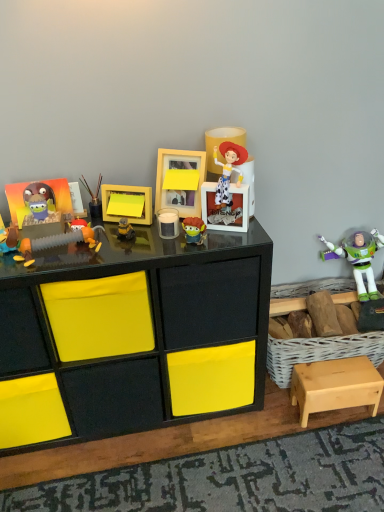
Identify the location of free space between matte orange toy at center-left, which is the third toy from left to right, and matte plastic toy at left, the 7th toy positioned from the right. coord(46,247).